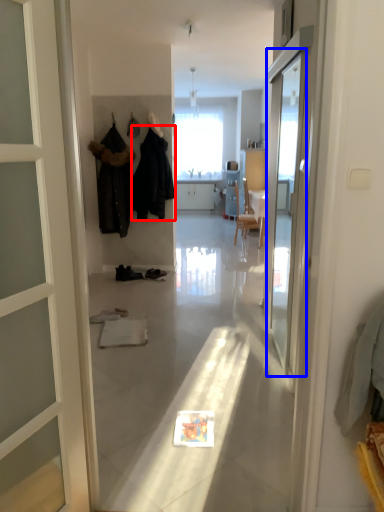
Question: Among these objects, which one is farthest to the camera, clothing (highlighted by a red box) or screen door (highlighted by a blue box)?

Choices:
 (A) clothing
 (B) screen door

Answer: (A)